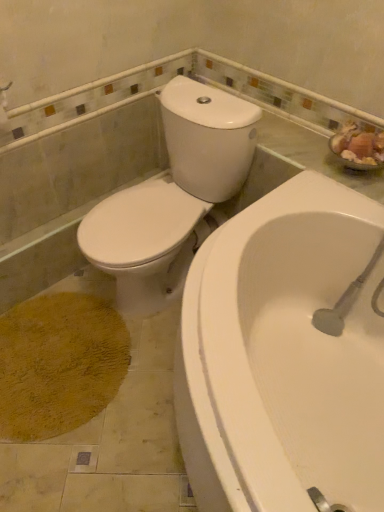
Question: Is white glossy toilet at upper left thinner than white glossy bathtub at lower right?

Choices:
 (A) no
 (B) yes

Answer: (B)

Question: Can you confirm if white glossy toilet at upper left is positioned to the left of white glossy bathtub at lower right?

Choices:
 (A) yes
 (B) no

Answer: (A)

Question: From the image's perspective, is white glossy toilet at upper left located above white glossy bathtub at lower right?

Choices:
 (A) no
 (B) yes

Answer: (B)

Question: Is white glossy toilet at upper left positioned with its back to white glossy bathtub at lower right?

Choices:
 (A) yes
 (B) no

Answer: (B)

Question: Is white glossy toilet at upper left not inside white glossy bathtub at lower right?

Choices:
 (A) yes
 (B) no

Answer: (A)

Question: Does white glossy toilet at upper left have a smaller size compared to white glossy bathtub at lower right?

Choices:
 (A) yes
 (B) no

Answer: (A)

Question: Can you confirm if white glossy bathtub at lower right is positioned to the right of white glossy toilet at upper left?

Choices:
 (A) no
 (B) yes

Answer: (B)

Question: Considering the relative sizes of white glossy bathtub at lower right and white glossy toilet at upper left in the image provided, is white glossy bathtub at lower right thinner than white glossy toilet at upper left?

Choices:
 (A) no
 (B) yes

Answer: (A)

Question: Does white glossy bathtub at lower right appear on the left side of white glossy toilet at upper left?

Choices:
 (A) yes
 (B) no

Answer: (B)

Question: Does white glossy bathtub at lower right have a lesser height compared to white glossy toilet at upper left?

Choices:
 (A) no
 (B) yes

Answer: (B)

Question: Would you say white glossy bathtub at lower right is outside white glossy toilet at upper left?

Choices:
 (A) no
 (B) yes

Answer: (B)

Question: From a real-world perspective, is white glossy bathtub at lower right beneath white glossy toilet at upper left?

Choices:
 (A) yes
 (B) no

Answer: (A)

Question: Visually, is white glossy bathtub at lower right positioned to the left or to the right of white glossy toilet at upper left?

Choices:
 (A) right
 (B) left

Answer: (A)